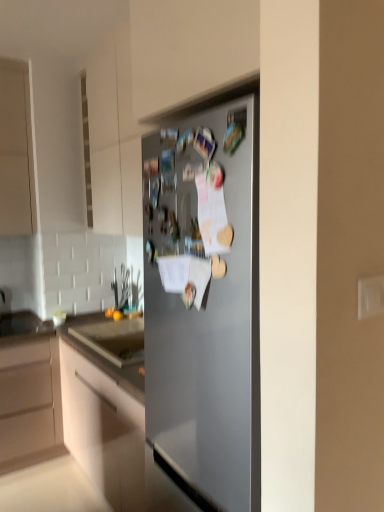
Question: Is point (150, 254) positioned closer to the camera than point (16, 459)?

Choices:
 (A) closer
 (B) farther

Answer: (A)

Question: Relative to matte white cabinet at center, is satin silver fridge at center in front or behind?

Choices:
 (A) behind
 (B) front

Answer: (B)

Question: From the image's perspective, is satin silver fridge at center above or below matte white cabinet at center?

Choices:
 (A) above
 (B) below

Answer: (A)

Question: Considering the positions of matte white cabinet at center and satin silver fridge at center in the image, is matte white cabinet at center taller or shorter than satin silver fridge at center?

Choices:
 (A) short
 (B) tall

Answer: (B)

Question: Is point (0, 406) closer or farther from the camera than point (175, 346)?

Choices:
 (A) farther
 (B) closer

Answer: (A)

Question: Considering the positions of matte white cabinet at center and satin silver fridge at center in the image, is matte white cabinet at center bigger or smaller than satin silver fridge at center?

Choices:
 (A) small
 (B) big

Answer: (B)

Question: From the image's perspective, is matte white cabinet at center positioned above or below satin silver fridge at center?

Choices:
 (A) above
 (B) below

Answer: (B)